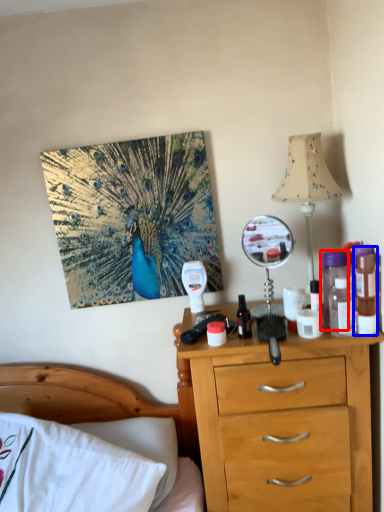
Question: Which object appears farthest to the camera in this image, bottle (highlighted by a red box) or bottle (highlighted by a blue box)?

Choices:
 (A) bottle
 (B) bottle

Answer: (A)